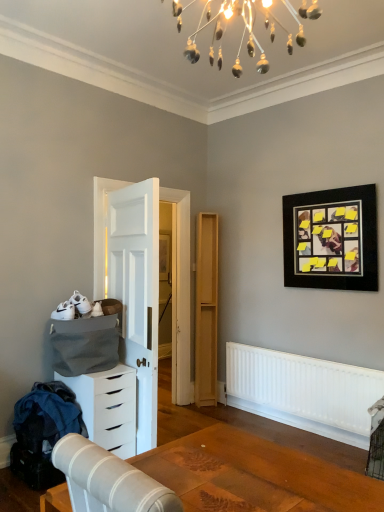
I want to click on wooden table at lower center, so click(x=255, y=475).

Describe the element at coordinates (206, 310) in the screenshot. I see `light wood/file cabinet at center` at that location.

Describe the element at coordinates (303, 391) in the screenshot. The image size is (384, 512). I see `white matte radiator at lower right` at that location.

Find the location of a particular element. This screenshot has width=384, height=512. white wooden door at center is located at coordinates (137, 292).

From a real-world perspective, does white wooden door at center stand above denim fabric at lower left?

Yes, from a real-world perspective, white wooden door at center is on top of denim fabric at lower left.

Is white wooden door at center aimed at denim fabric at lower left?

No, white wooden door at center is not turned towards denim fabric at lower left.

You are a GUI agent. You are given a task and a screenshot of the screen. Output one action in this format:
    pyautogui.click(x=<x>, y=<y>)
    Task: Click on the door that appears on the right of denim fabric at lower left
    This screenshot has width=384, height=512.
    Given the screenshot: What is the action you would take?
    pyautogui.click(x=137, y=292)

Can you confirm if white wooden door at center is taller than denim fabric at lower left?

Indeed, white wooden door at center has a greater height compared to denim fabric at lower left.

I want to click on radiator in front of the light wood/file cabinet at center, so click(303, 391).

Is light wood/file cabinet at center far away from white matte radiator at lower right?

No.

Choose the correct answer: Is light wood/file cabinet at center inside white matte radiator at lower right or outside it?

light wood/file cabinet at center is located beyond the bounds of white matte radiator at lower right.

Considering the relative sizes of white matte radiator at lower right and white matte chest of drawers at lower left in the image provided, is white matte radiator at lower right bigger than white matte chest of drawers at lower left?

No, white matte radiator at lower right is not bigger than white matte chest of drawers at lower left.

Is white matte radiator at lower right thinner than white matte chest of drawers at lower left?

Yes, white matte radiator at lower right is thinner than white matte chest of drawers at lower left.

How much distance is there between white matte radiator at lower right and white matte chest of drawers at lower left?

They are 1.64 meters apart.

Which object is further away from the camera, denim fabric at lower left or white wooden door at center?

white wooden door at center is more distant.

At what (x,y) coordinates should I click in order to perform the action: click on laundry on the left of white wooden door at center. Please return your answer as a coordinate pair (x, y). The image size is (384, 512). Looking at the image, I should click on (47, 416).

Considering the sizes of objects denim fabric at lower left and white wooden door at center in the image provided, who is shorter, denim fabric at lower left or white wooden door at center?

denim fabric at lower left.

What's the angular difference between denim fabric at lower left and white wooden door at center's facing directions?

4.48 degrees separate the facing orientations of denim fabric at lower left and white wooden door at center.

Is white matte chest of drawers at lower left aimed at black matte picture frame at upper right?

No.

From a real-world perspective, is white matte chest of drawers at lower left above or below black matte picture frame at upper right?

white matte chest of drawers at lower left is situated lower than black matte picture frame at upper right in the real world.

Is point (107, 428) in front of point (355, 286)?

Yes, it is in front of point (355, 286).

Is wooden table at lower center facing away from white matte radiator at lower right?

wooden table at lower center does not have its back to white matte radiator at lower right.

Which of these two, wooden table at lower center or white matte radiator at lower right, is wider?

With larger width is wooden table at lower center.

How different are the orientations of wooden table at lower center and white matte radiator at lower right in degrees?

The angle between the facing direction of wooden table at lower center and the facing direction of white matte radiator at lower right is 177 degrees.

Is wooden table at lower center at the right side of white matte radiator at lower right?

Incorrect, wooden table at lower center is not on the right side of white matte radiator at lower right.

Which object is further away from the camera taking this photo, white matte chest of drawers at lower left or white matte radiator at lower right?

Positioned behind is white matte radiator at lower right.

From the picture: From a real-world perspective, relative to white matte radiator at lower right, is white matte chest of drawers at lower left vertically above or below?

white matte chest of drawers at lower left is situated lower than white matte radiator at lower right in the real world.

How different are the orientations of white matte chest of drawers at lower left and white matte radiator at lower right in degrees?

They differ by 87.7 degrees in their facing directions.

Which is in front, point (125, 385) or point (257, 408)?

The point (125, 385) is closer to the camera.

Identify the location of laundry that is below the white wooden door at center (from the image's perspective). (47, 416).

I want to click on file cabinet lying on the left of white matte radiator at lower right, so click(x=206, y=310).

Which object lies nearer to the anchor point black matte picture frame at upper right, white matte radiator at lower right or white wooden door at center?

white matte radiator at lower right is closer to black matte picture frame at upper right.

Considering their positions, is wooden table at lower center positioned closer to denim fabric at lower left than white wooden door at center?

white wooden door at center is closer to denim fabric at lower left.

Based on their spatial positions, is white matte radiator at lower right or black matte picture frame at upper right closer to white wooden door at center?

Among the two, white matte radiator at lower right is located nearer to white wooden door at center.

When comparing their distances from denim fabric at lower left, does light wood/file cabinet at center or white wooden door at center seem closer?

white wooden door at center is positioned closer to the anchor denim fabric at lower left.

Considering their positions, is white wooden door at center positioned further to wooden table at lower center than black matte picture frame at upper right?

Based on the image, black matte picture frame at upper right appears to be further to wooden table at lower center.

Based on their spatial positions, is white matte chest of drawers at lower left or black matte picture frame at upper right further from light wood/file cabinet at center?

white matte chest of drawers at lower left is further to light wood/file cabinet at center.

Estimate the real-world distances between objects in this image. Which object is closer to denim fabric at lower left, light wood/file cabinet at center or black matte picture frame at upper right?

Among the two, light wood/file cabinet at center is located nearer to denim fabric at lower left.

When comparing their distances from white matte chest of drawers at lower left, does denim fabric at lower left or light wood/file cabinet at center seem closer?

denim fabric at lower left is closer to white matte chest of drawers at lower left.

At what (x,y) coordinates should I click in order to perform the action: click on door situated between denim fabric at lower left and black matte picture frame at upper right from left to right. Please return your answer as a coordinate pair (x, y). Looking at the image, I should click on (137, 292).

At what (x,y) coordinates should I click in order to perform the action: click on chest of drawers between denim fabric at lower left and black matte picture frame at upper right in the horizontal direction. Please return your answer as a coordinate pair (x, y). Looking at the image, I should click on (108, 407).

Locate an element on the screen. The height and width of the screenshot is (512, 384). radiator between white wooden door at center and black matte picture frame at upper right in the horizontal direction is located at coordinates (303, 391).

This screenshot has width=384, height=512. I want to click on door between denim fabric at lower left and light wood/file cabinet at center along the z-axis, so click(x=137, y=292).